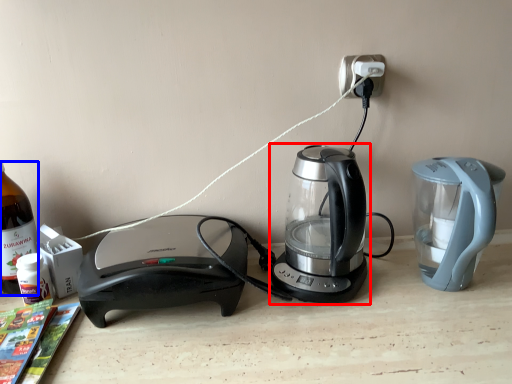
Question: Which object is further to the camera taking this photo, kettle (highlighted by a red box) or bottle (highlighted by a blue box)?

Choices:
 (A) kettle
 (B) bottle

Answer: (B)